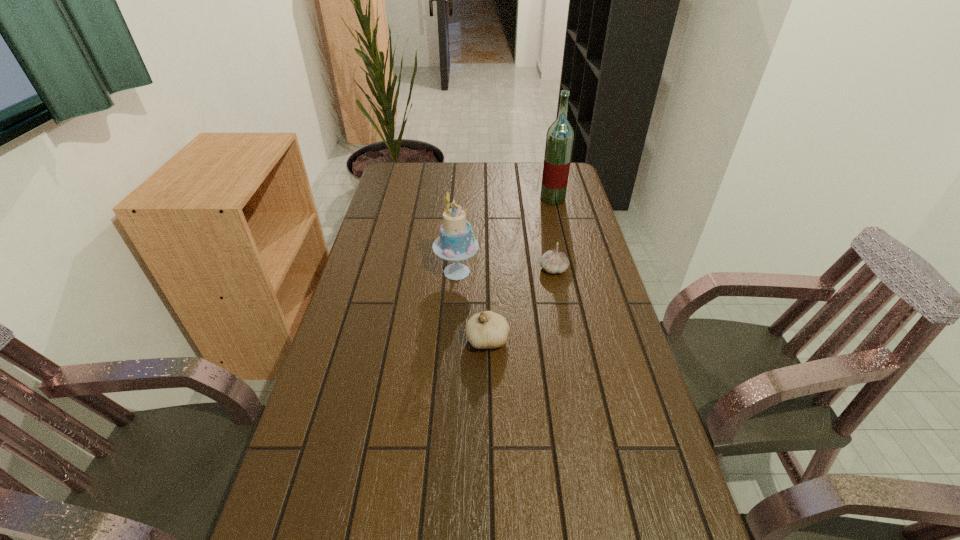
This screenshot has height=540, width=960. I want to click on free space that satisfies the following two spatial constraints: 1. on the back side of the left garlic; 2. with a ladder on the side of the cake, so coord(487,272).

This screenshot has height=540, width=960. What are the coordinates of `blank area in the image that satisfies the following two spatial constraints: 1. on the back side of the left garlic; 2. with a ladder on the side of the third shortest object` in the screenshot? It's located at (487, 272).